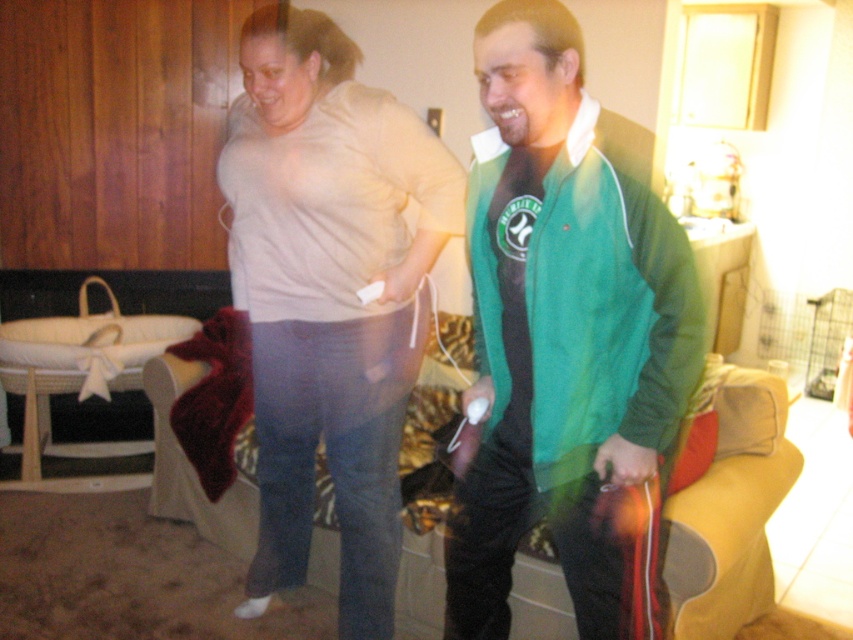
You are a photographer standing in front of the two individuals in the living room. You want to take a photo that focuses on the green fleece jacket at center and the matte beige shirt at center. Which of the two will appear larger in the photo?

The green fleece jacket at center will appear larger in the photo because it is closer to the viewer than the matte beige shirt at center.

You are standing in the living room and want to place a small decorative item between the two points, point (546, 172) and point (323, 76). Which point should you place it closer to so that it is closer to the front of the room?

You should place the item closer to point (546, 172) because it is in front of point (323, 76).